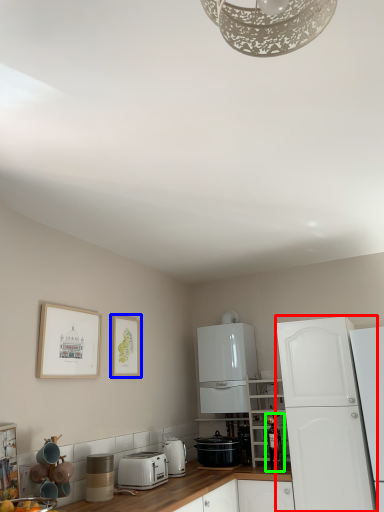
Question: Which object is positioned closest to cabinetry (highlighted by a red box)? Select from picture frame (highlighted by a blue box) and appliance (highlighted by a green box).

Choices:
 (A) picture frame
 (B) appliance

Answer: (B)